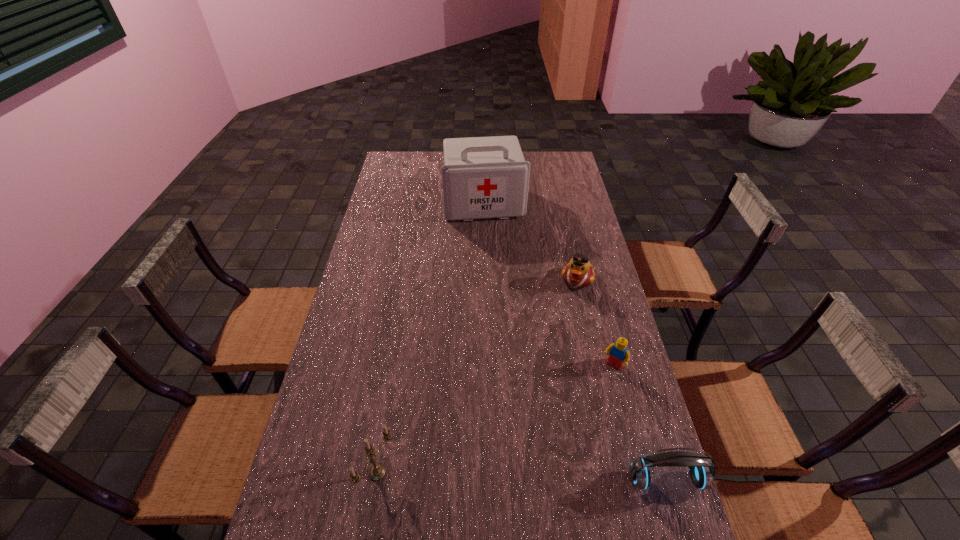
Find the location of a particular element. unoccupied position between the leftmost object and the duck is located at coordinates (477, 376).

Where is `blank region between the leftmost object and the farthest object`? The image size is (960, 540). blank region between the leftmost object and the farthest object is located at coordinates (431, 338).

Identify the location of free space between the tallest object and the headset. The image size is (960, 540). pyautogui.click(x=575, y=341).

The width and height of the screenshot is (960, 540). What are the coordinates of `vacant point located between the fourth object from right to left and the third nearest object` in the screenshot? It's located at (548, 285).

The width and height of the screenshot is (960, 540). I want to click on free space between the first-aid kit and the Lego, so click(548, 285).

Locate an element on the screen. vacant area that lies between the duck and the candle is located at coordinates (477, 376).

Locate an element on the screen. free space between the second tallest object and the headset is located at coordinates (521, 476).

Locate which object ranks third in proximity to the third farthest object. Please provide its 2D coordinates. Your answer should be formatted as a tuple, i.e. [(x, y)], where the tuple contains the x and y coordinates of a point satisfying the conditions above.

[(377, 472)]

Locate which object is the fourth closest to the second object from left to right. Please provide its 2D coordinates. Your answer should be formatted as a tuple, i.e. [(x, y)], where the tuple contains the x and y coordinates of a point satisfying the conditions above.

[(701, 468)]

Find the location of `vacant space that satisfies the following two spatial constraints: 1. on the back side of the third farthest object; 2. on the left side of the leftmost object`. vacant space that satisfies the following two spatial constraints: 1. on the back side of the third farthest object; 2. on the left side of the leftmost object is located at coordinates (396, 366).